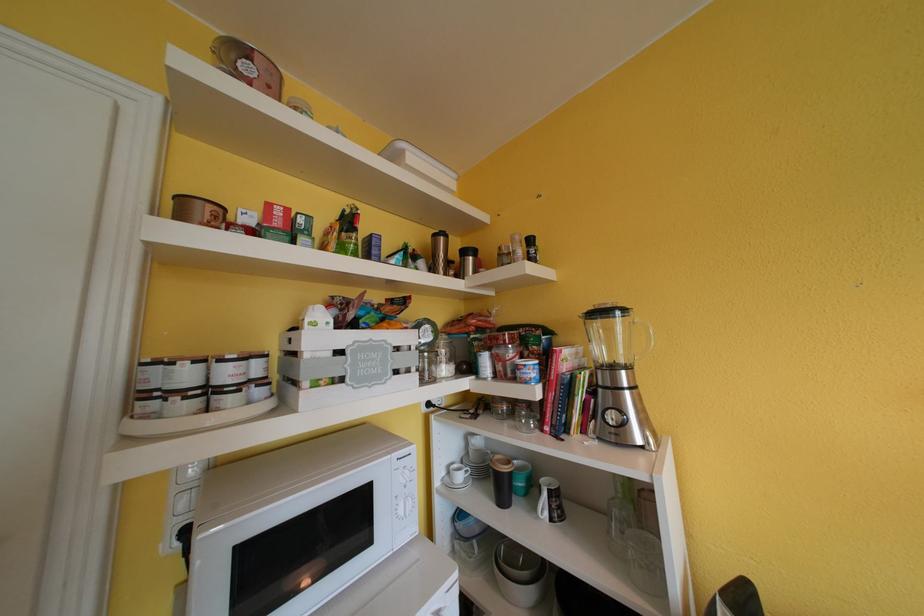
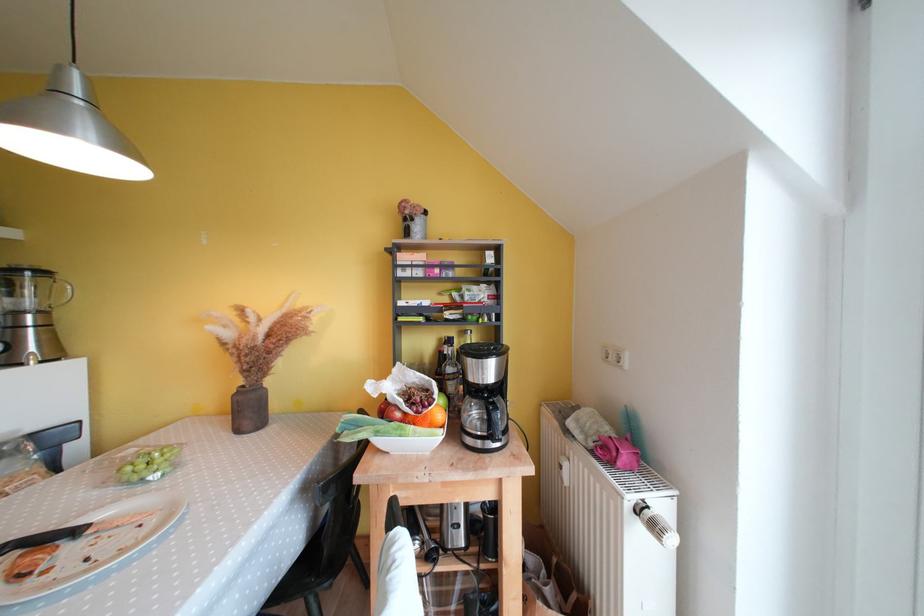
Where in the second image is the point corresponding to the point at 636,371 from the first image?

(49, 315)